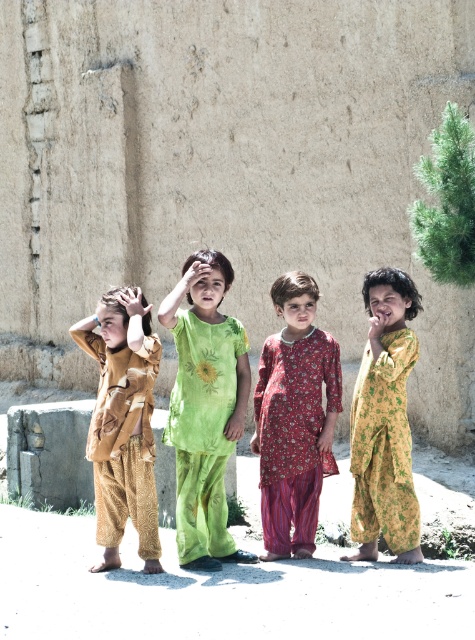
You are a photographer trying to capture the children in the scene. You notice the floral printed dress at center marked by point (294, 435). Where should you position your camera to ensure the floral printed dress at center is in the center of your photo?

To center the floral printed dress at center, position the camera so that the point (294, 435) aligns with the center of the frame.

You are a photographer trying to capture a closeup shot of the floral printed dress at center and the smooth skin hand at center. Which object should you zoom in on to ensure it fills more of the frame without moving the camera?

The floral printed dress at center is bigger than the smooth skin hand at center, so zooming in on the floral printed dress at center will fill more of the frame.

In the scene shown: You are a photographer setting up a camera to take a group photo of the matte brown outfit at left and the floral printed dress at center. Based on their heights, which child should stand in the front row to ensure both are visible?

The floral printed dress at center should stand in the front row because the matte brown outfit at left is taller than the floral printed dress at center, allowing the shorter child to be visible in front.